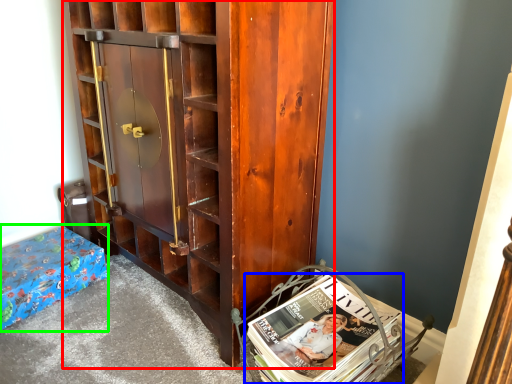
Question: Based on their relative distances, which object is nearer to cabinetry (highlighted by a red box)? Choose from book (highlighted by a blue box) and furniture (highlighted by a green box).

Choices:
 (A) book
 (B) furniture

Answer: (A)